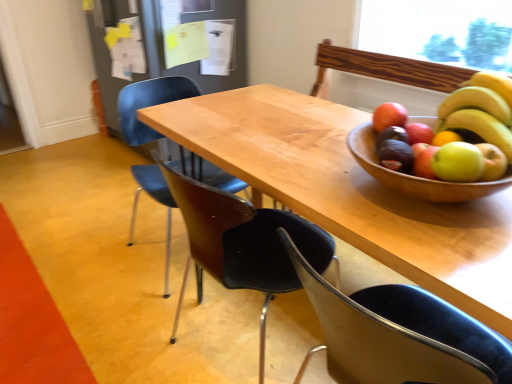
Question: From the image's perspective, is natural wood table at center positioned above or below green matte avocado at right, the 2th avocado in the front-to-back sequence?

Choices:
 (A) above
 (B) below

Answer: (B)

Question: Which is correct: natural wood table at center is inside green matte avocado at right, the 2th avocado in the front-to-back sequence, or outside of it?

Choices:
 (A) inside
 (B) outside

Answer: (B)

Question: Considering the real-world distances, which object is closest to the matte black chair at center, arranged as the 1th chair when viewed from the back?

Choices:
 (A) matte black avocado at right, which appears as the 2th avocado when viewed from the back
 (B) brown leather chair at center, the second chair viewed from the back
 (C) black plastic chair at lower right, placed as the first chair when sorted from front to back
 (D) yellow matte bananas at upper right
 (E) natural wood table at center

Answer: (E)

Question: Which object is positioned closest to the brown leather chair at center, the second chair viewed from the back?

Choices:
 (A) yellow matte bananas at upper right
 (B) matte black avocado at right, which is the first avocado from front to back
 (C) green matte avocado at right, the 2th avocado in the front-to-back sequence
 (D) black plastic chair at lower right, placed as the first chair when sorted from front to back
 (E) natural wood table at center

Answer: (D)